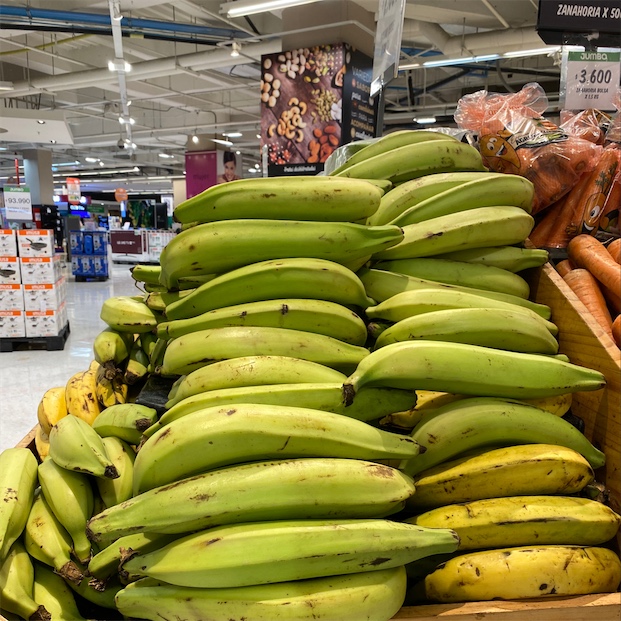
I want to click on large posters, so click(320, 86), click(220, 161).